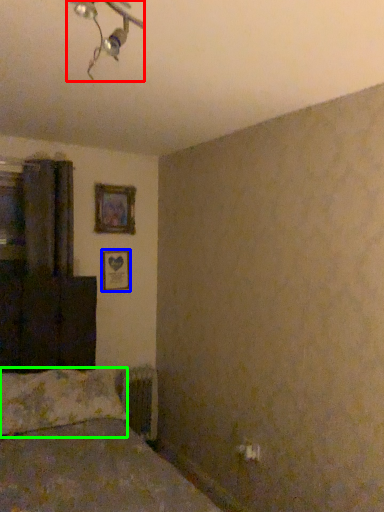
Question: Which object is positioned closest to light fixture (highlighted by a red box)? Select from picture frame (highlighted by a blue box) and pillow (highlighted by a green box).

Choices:
 (A) picture frame
 (B) pillow

Answer: (B)